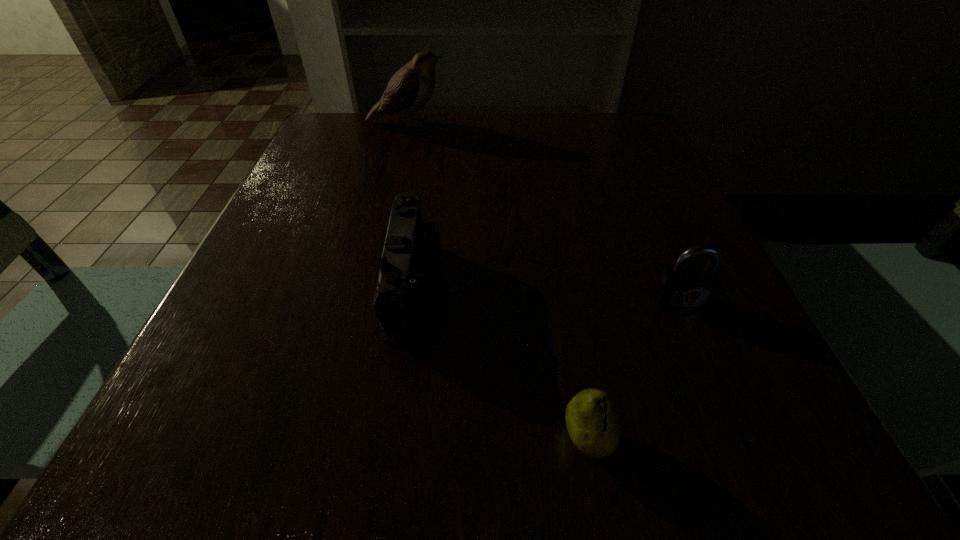
Locate an element on the screen. This screenshot has width=960, height=540. the tallest object is located at coordinates (410, 88).

Locate an element on the screen. The width and height of the screenshot is (960, 540). the farthest object is located at coordinates (410, 88).

At what (x,y) coordinates should I click in order to perform the action: click on the rightmost object. Please return your answer as a coordinate pair (x, y). The width and height of the screenshot is (960, 540). Looking at the image, I should click on (681, 286).

Image resolution: width=960 pixels, height=540 pixels. In order to click on camcorder in this screenshot , I will do `click(408, 269)`.

Find the location of a particular element. The width and height of the screenshot is (960, 540). the second object from right to left is located at coordinates (593, 421).

Image resolution: width=960 pixels, height=540 pixels. Identify the location of pear. (593, 421).

The image size is (960, 540). I want to click on free region located at the face of the tallest object, so click(559, 123).

Locate an element on the screen. This screenshot has width=960, height=540. free spot located on the front of the padlock near the keyhole is located at coordinates (715, 381).

Image resolution: width=960 pixels, height=540 pixels. What are the coordinates of `vacant space positioned 0.260m on the front-facing side of the camcorder` in the screenshot? It's located at (601, 284).

Where is `vacant area situated on the left of the pear`? The height and width of the screenshot is (540, 960). vacant area situated on the left of the pear is located at coordinates (333, 441).